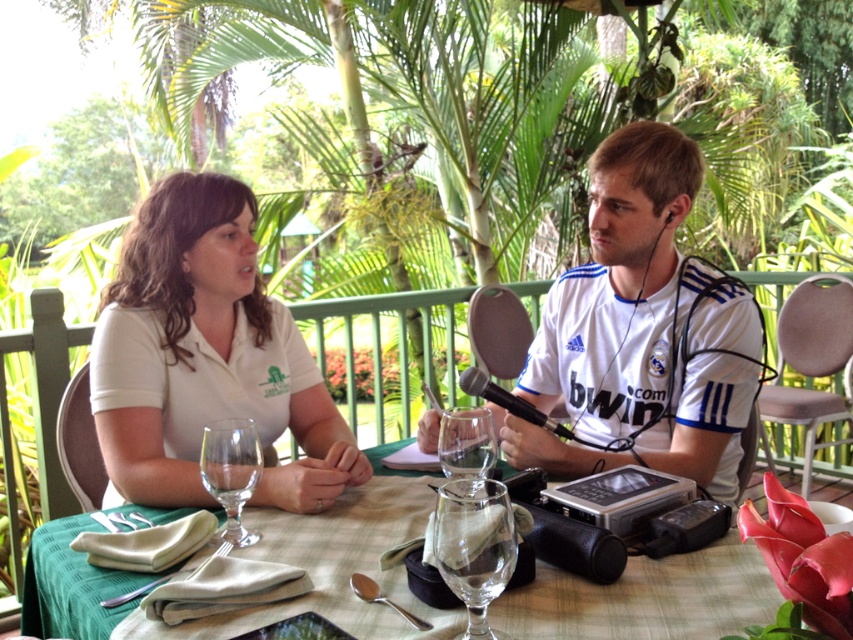
Question: Which point appears farthest from the camera in this image?

Choices:
 (A) (468, 426)
 (B) (683, 404)
 (C) (244, 476)

Answer: (B)

Question: Where is white matte shirt at center located in relation to silver spoon at lower center in the image?

Choices:
 (A) left
 (B) right

Answer: (A)

Question: Which point is closer to the camera?

Choices:
 (A) silver spoon at lower center
 (B) silvermetallicspoon at lower center

Answer: (A)

Question: Can you confirm if green fabric table at center is bigger than transparent glass wine glass at center?

Choices:
 (A) yes
 (B) no

Answer: (A)

Question: Among these objects, which one is nearest to the camera?

Choices:
 (A) silvermetallicspoon at lower center
 (B) white matte shirt at center

Answer: (A)

Question: Observing the image, what is the correct spatial positioning of white matte shirt at center in reference to green fabric table at center?

Choices:
 (A) left
 (B) right

Answer: (A)